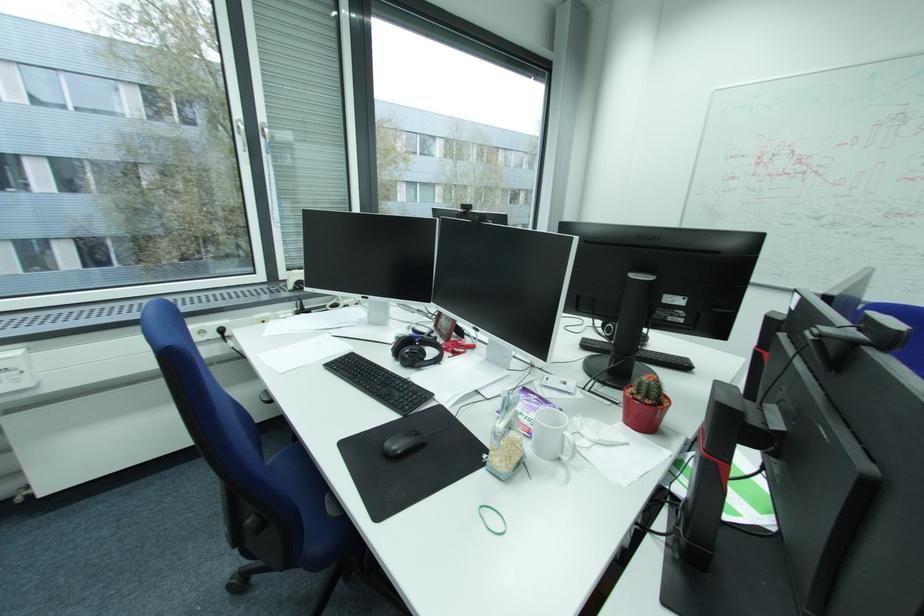
This screenshot has height=616, width=924. Find the location of `green rubber band`. green rubber band is located at coordinates (492, 519).